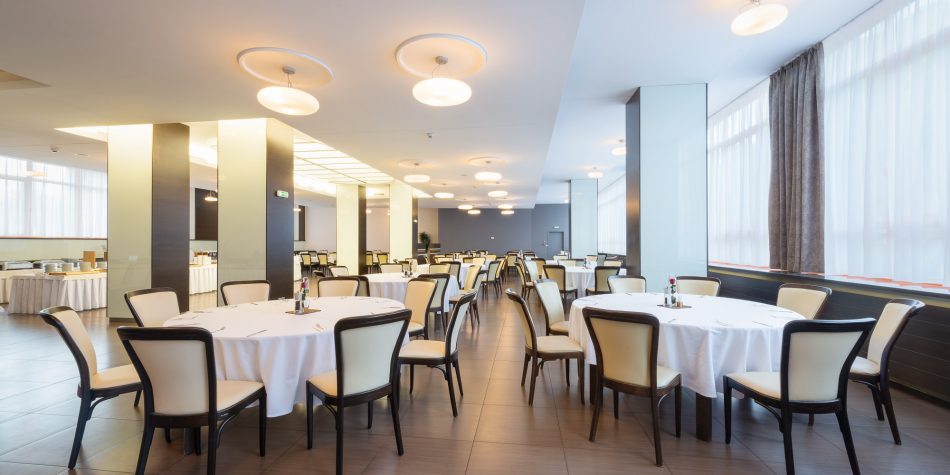
The width and height of the screenshot is (950, 475). In order to click on tables in this screenshot , I will do `click(48, 285)`, `click(276, 348)`, `click(700, 344)`, `click(576, 275)`, `click(382, 283)`, `click(463, 268)`, `click(315, 256)`, `click(551, 258)`, `click(375, 256)`.